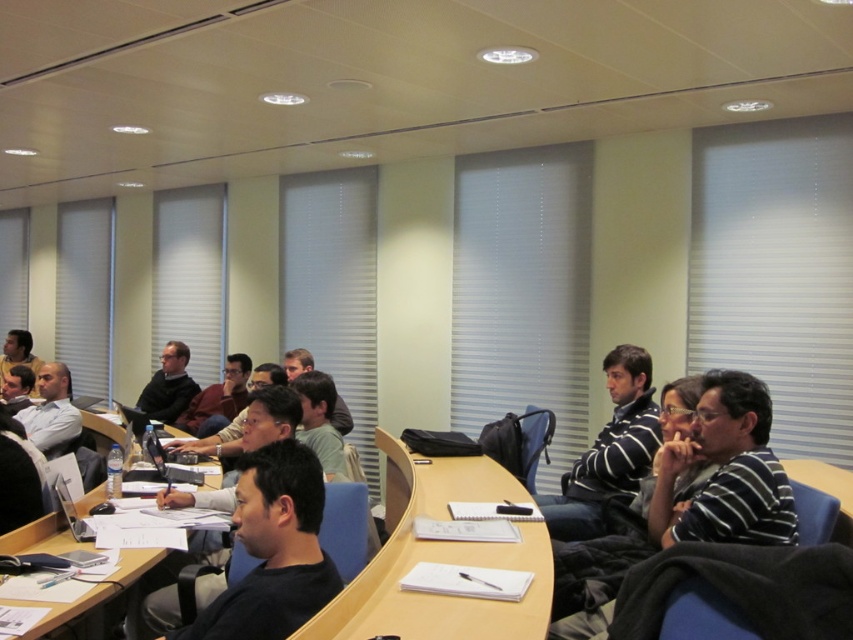
Question: Which point is closer to the camera?

Choices:
 (A) matte white shirt at center
 (B) dark gray sweater at center
 (C) black matte shirt at center
 (D) striped cotton shirt at center

Answer: (C)

Question: Which is farther from the white paper at center?

Choices:
 (A) striped cotton shirt at center
 (B) striped sweater at center

Answer: (B)

Question: Estimate the real-world distances between objects in this image. Which object is farther from the striped cotton shirt at center?

Choices:
 (A) black matte shirt at center
 (B) white paper at center
 (C) matte white shirt at center

Answer: (C)

Question: Is striped cotton shirt at center bigger than matte black glasses at center?

Choices:
 (A) yes
 (B) no

Answer: (B)

Question: Where is striped sweater at center located in relation to matte black glasses at center in the image?

Choices:
 (A) right
 (B) left

Answer: (A)

Question: Is the position of striped sweater at center less distant than that of dark gray sweater at center?

Choices:
 (A) yes
 (B) no

Answer: (A)